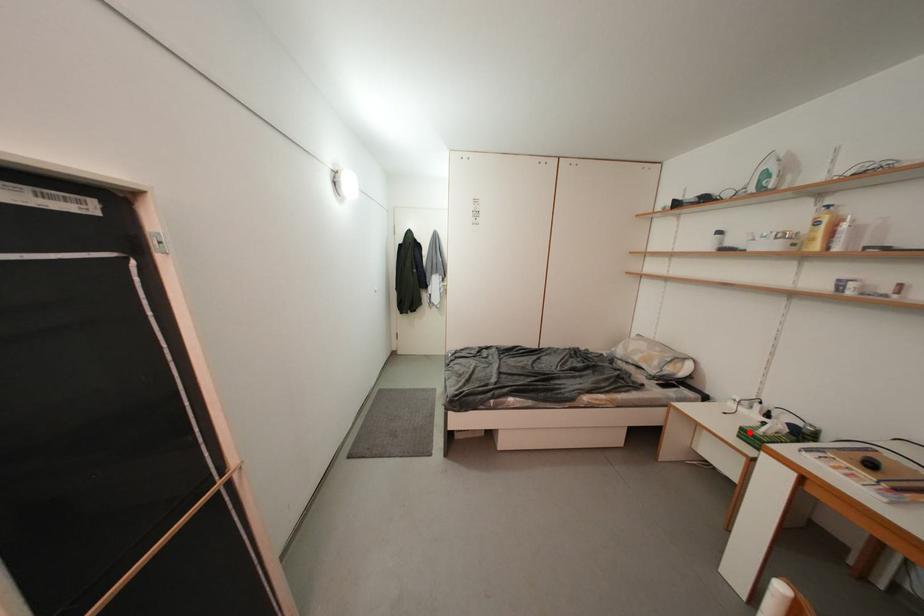
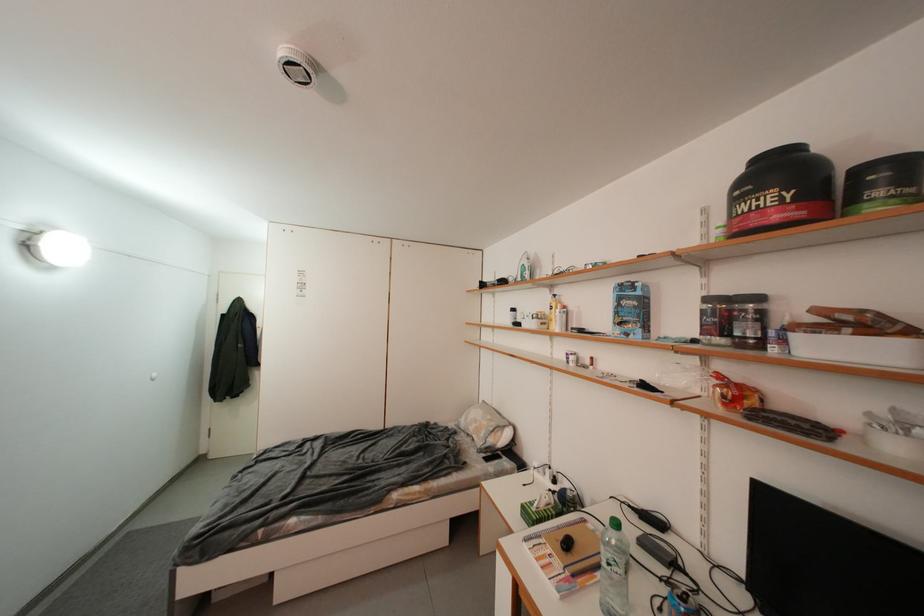
Question: I am providing you with two images of the same scene from different viewpoints. Image1 has a red point marked. In image2, the corresponding 3D location appears at what relative position? Reply with the corresponding letter.

Choices:
 (A) Closer
 (B) Farther

Answer: (A)